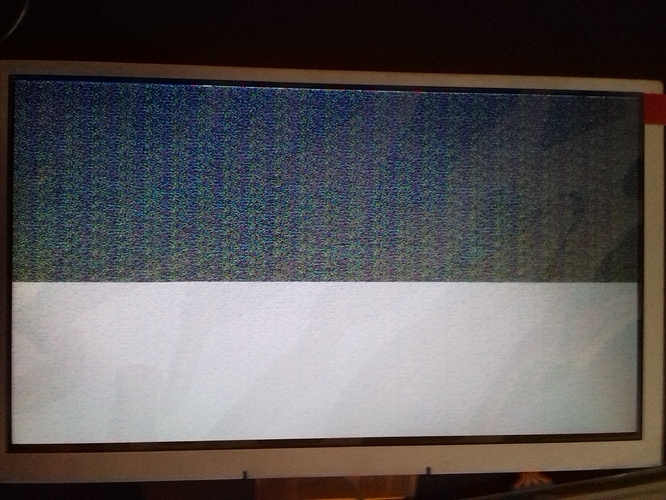
Image resolution: width=666 pixels, height=500 pixels. Find the location of `wall`. wall is located at coordinates (461, 464).